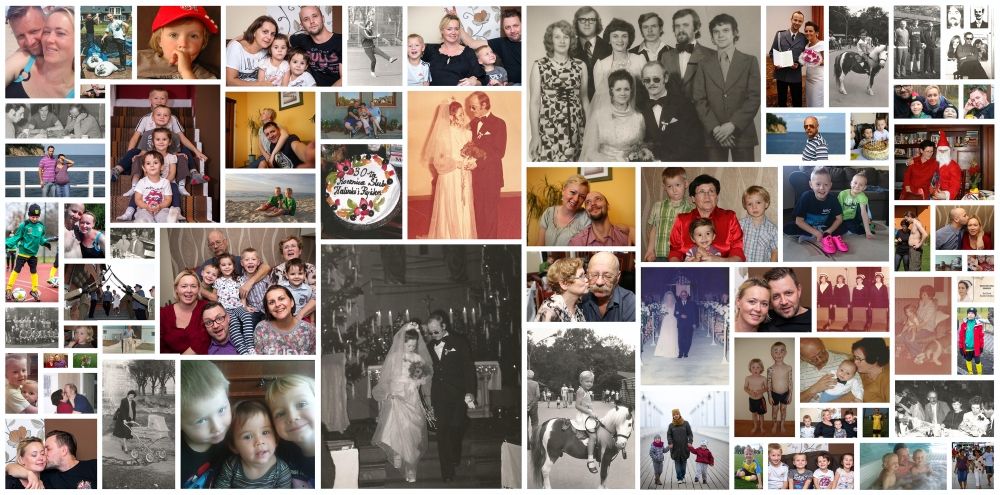
Find the location of `pictures on the left side of the image`. pictures on the left side of the image is located at coordinates (33, 62), (14, 115), (19, 160), (24, 226), (21, 317), (18, 367), (26, 436).